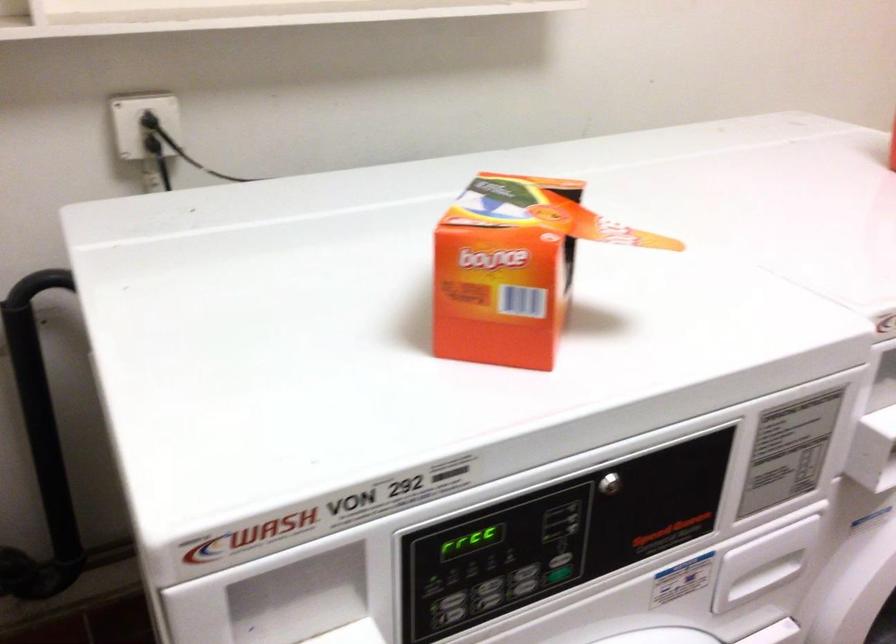
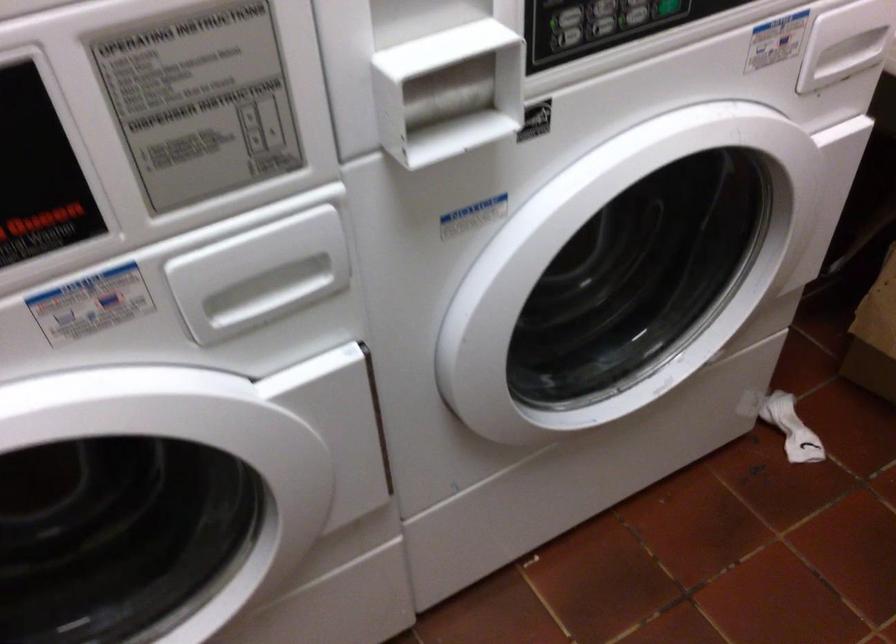
The images are taken continuously from a first-person perspective. In which direction are you moving?

The movement direction of the cameraman is right, forward.